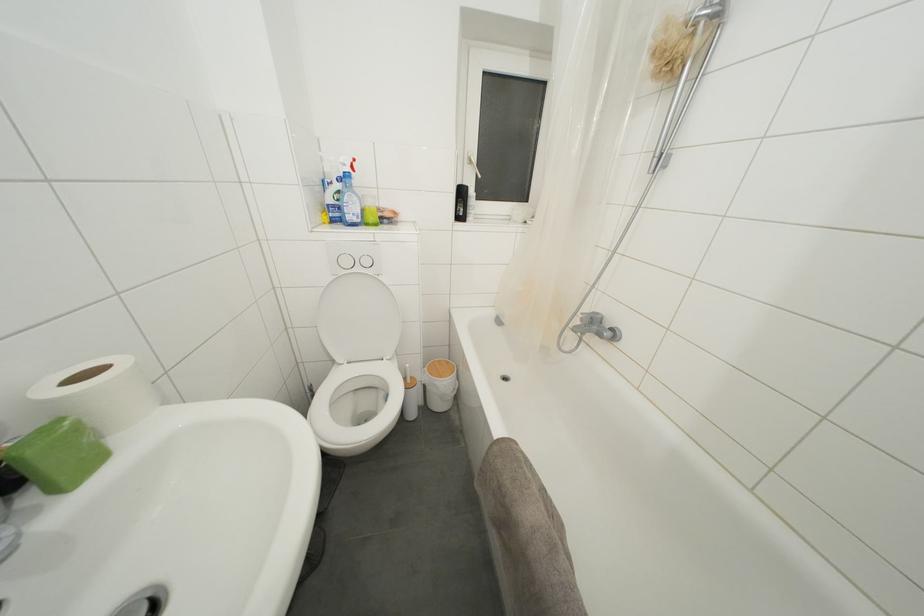
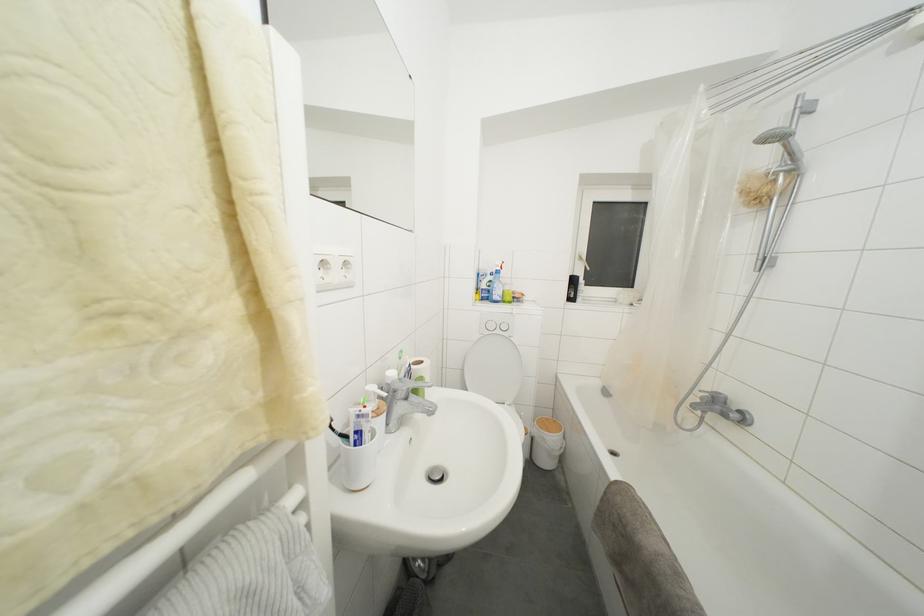
The first image is from the beginning of the video and the second image is from the end. How did the camera likely rotate when shooting the video?

The camera's rotation is toward left-up.